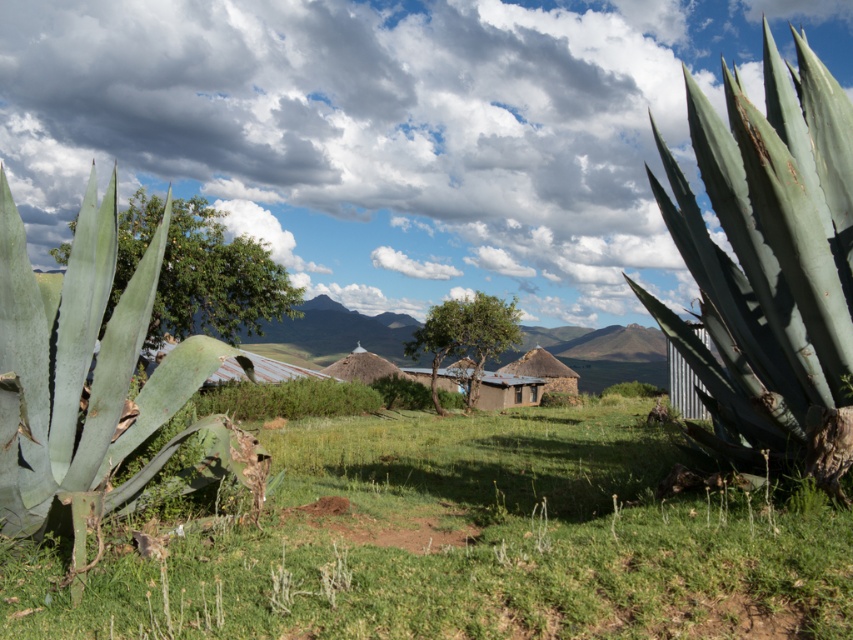
Question: Among these points, which one is farthest from the camera?

Choices:
 (A) (142, 244)
 (B) (849, 305)

Answer: (A)

Question: Which of these objects is positioned farthest from the green leafy tree at center?

Choices:
 (A) green succulent at left
 (B) green grassy at center

Answer: (A)

Question: Is the position of green succulent at left more distant than that of green leafy tree at center?

Choices:
 (A) no
 (B) yes

Answer: (A)

Question: Which point is closer to the camera?

Choices:
 (A) green grassy at center
 (B) green succulent at left

Answer: (A)

Question: Does green succulent at left appear under green leafy tree at center?

Choices:
 (A) no
 (B) yes

Answer: (B)

Question: Is green grassy at center in front of green leafy tree at center?

Choices:
 (A) yes
 (B) no

Answer: (A)